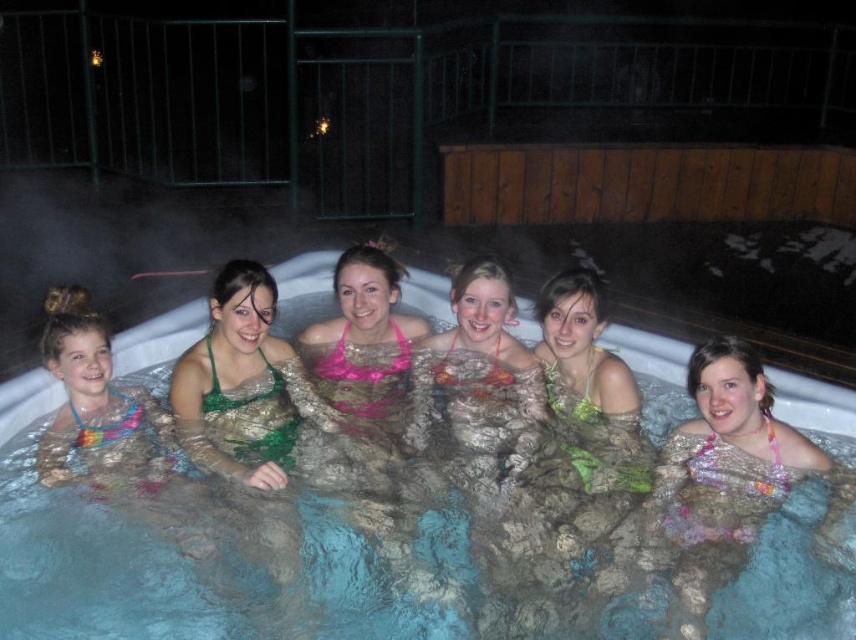
You are a photographer trying to capture a clear shot of the pink floral bikini at center without the clear plastic pool at center blocking it. Is this feasible given their sizes?

The clear plastic pool at center is bigger than the pink floral bikini at center, so it may block the view of the bikini depending on their positions. Adjust your angle to ensure the bikini is not obscured by the pool.

You are a photographer standing in front of the hot tub. You want to take a photo focusing on the pink floral bikini at center and the pink fabric bikini at center. Which one will appear larger in the photo?

The pink floral bikini at center will appear larger in the photo because it is closer to the viewer than the pink fabric bikini at center.

Based on the photo, you are a photographer trying to capture a closeup of the pink floral bikini at center and the pink fabric bikini at center in the hot tub scene. Which bikini should you zoom in on to ensure it fits entirely within your camera frame if the frame can only accommodate the smaller of the two?

The pink floral bikini at center occupies less space than the pink fabric bikini at center, so you should zoom in on the pink floral bikini at center to ensure it fits entirely within the camera frame.